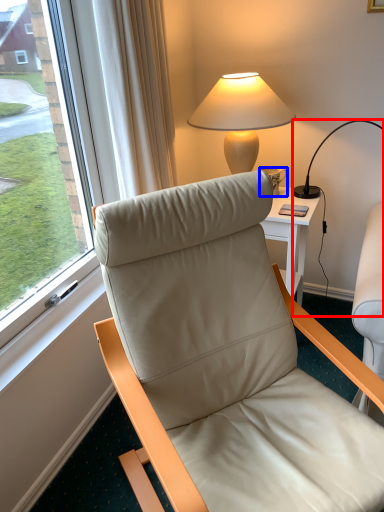
Question: Among these objects, which one is nearest to the camera, lamp (highlighted by a red box) or coffee cup (highlighted by a blue box)?

Choices:
 (A) lamp
 (B) coffee cup

Answer: (A)